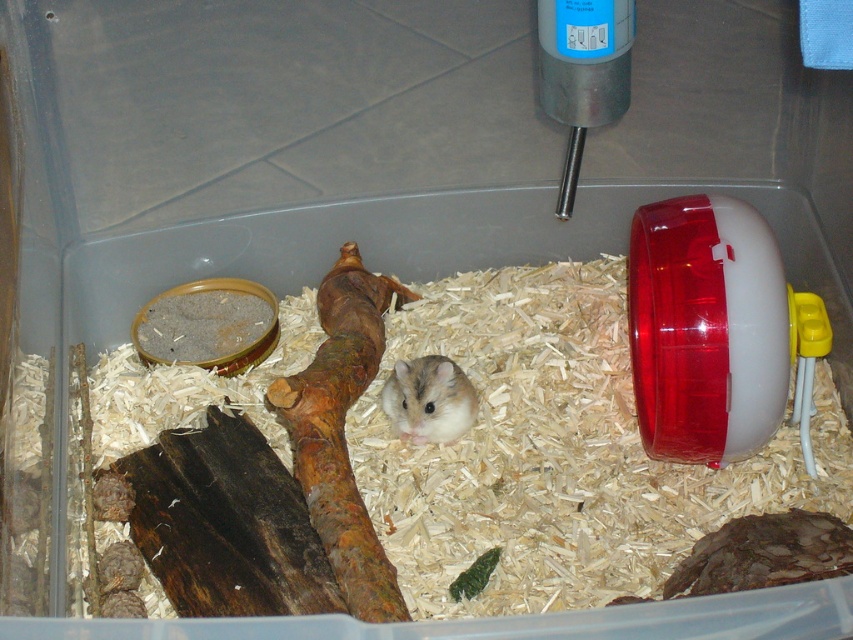
Question: Can you confirm if transparent plastic wheel at right is positioned below white fur hamster at center?

Choices:
 (A) yes
 (B) no

Answer: (B)

Question: Considering the relative positions of transparent plastic wheel at right and white fur hamster at center in the image provided, where is transparent plastic wheel at right located with respect to white fur hamster at center?

Choices:
 (A) below
 (B) above

Answer: (B)

Question: Among these points, which one is nearest to the camera?

Choices:
 (A) (648, 413)
 (B) (386, 410)

Answer: (A)

Question: Which object is farther from the camera taking this photo?

Choices:
 (A) transparent plastic wheel at right
 (B) white fur hamster at center

Answer: (B)

Question: Is transparent plastic wheel at right positioned behind white fur hamster at center?

Choices:
 (A) no
 (B) yes

Answer: (A)

Question: Among these points, which one is farthest from the camera?

Choices:
 (A) (689, 202)
 (B) (383, 403)

Answer: (B)